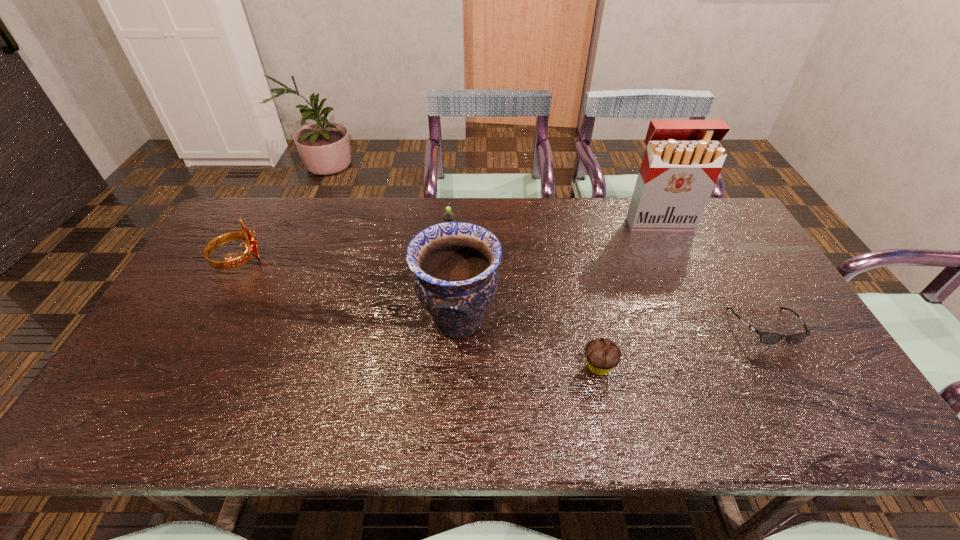
The image size is (960, 540). I want to click on free location that satisfies the following two spatial constraints: 1. on the front label of the soda; 2. on the left side of the fifth tallest object, so click(x=442, y=367).

I want to click on vacant space that satisfies the following two spatial constraints: 1. with the lid open on the tallest object; 2. on the front-facing side of the tiara, so click(677, 260).

Where is `free spot that satisfies the following two spatial constraints: 1. on the front label of the third shortest object; 2. on the front-facing side of the tiara`? The image size is (960, 540). free spot that satisfies the following two spatial constraints: 1. on the front label of the third shortest object; 2. on the front-facing side of the tiara is located at coordinates [449, 260].